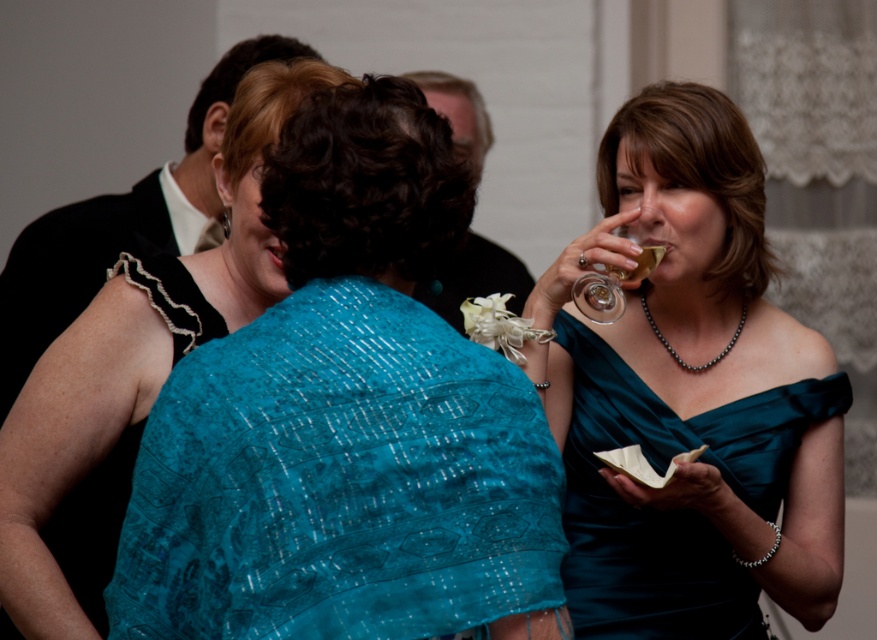
Between teal lace dress at center and translucent glass at upper right, which one appears on the left side from the viewer's perspective?

Positioned to the left is teal lace dress at center.

Is point (86, 524) closer to viewer compared to point (622, 275)?

Yes.

At what (x,y) coordinates should I click in order to perform the action: click on teal lace dress at center. Please return your answer as a coordinate pair (x, y). Looking at the image, I should click on (93, 525).

Can you confirm if teal satin dress at center is taller than translucent glass at upper right?

Yes, teal satin dress at center is taller than translucent glass at upper right.

Does teal satin dress at center come behind translucent glass at upper right?

No.

Does point (40, 564) come farther from viewer compared to point (660, 253)?

No.

Locate an element on the screen. The image size is (877, 640). teal satin dress at center is located at coordinates (136, 358).

Which is more to the left, teal lace shawl at center or teal satin dress at right?

From the viewer's perspective, teal lace shawl at center appears more on the left side.

Locate an element on the screen. The width and height of the screenshot is (877, 640). teal lace shawl at center is located at coordinates (x=346, y=419).